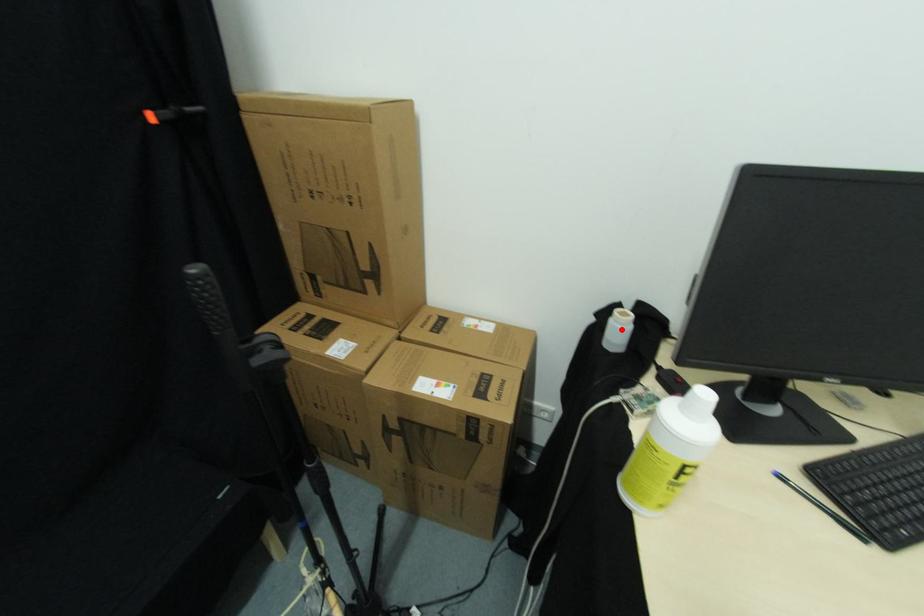
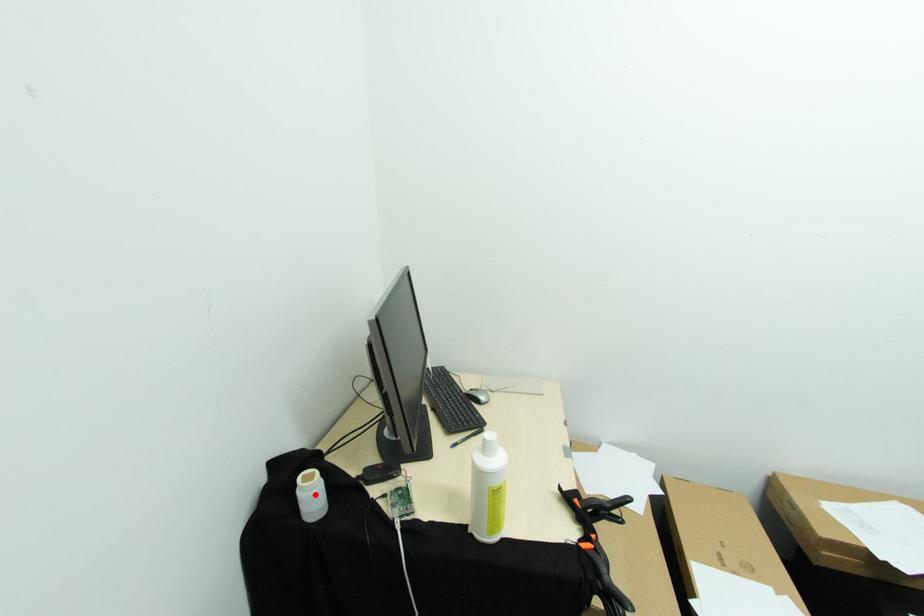
I am providing you with two images of the same scene from different viewpoints. A red point is marked on the first image and another point is marked on the second image. Is the marked point in image1 the same physical position as the marked point in image2?

Yes